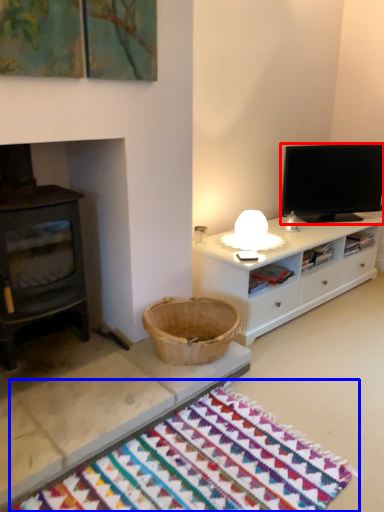
Question: Among these objects, which one is nearest to the camera, television (highlighted by a red box) or mat (highlighted by a blue box)?

Choices:
 (A) television
 (B) mat

Answer: (B)